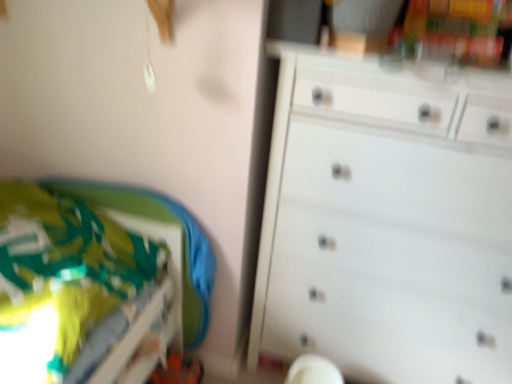
Question: Considering the positions of white matte chest of drawers at right and white plastic swivel chair at lower center in the image, is white matte chest of drawers at right wider or thinner than white plastic swivel chair at lower center?

Choices:
 (A) thin
 (B) wide

Answer: (B)

Question: Based on their sizes in the image, would you say white matte chest of drawers at right is bigger or smaller than white plastic swivel chair at lower center?

Choices:
 (A) small
 (B) big

Answer: (B)

Question: Estimate the real-world distances between objects in this image. Which object is farther from the green fabric bed at lower left?

Choices:
 (A) white plastic swivel chair at lower center
 (B) white matte chest of drawers at right

Answer: (A)

Question: Estimate the real-world distances between objects in this image. Which object is farther from the white matte chest of drawers at right?

Choices:
 (A) white plastic swivel chair at lower center
 (B) green fabric bed at lower left

Answer: (B)